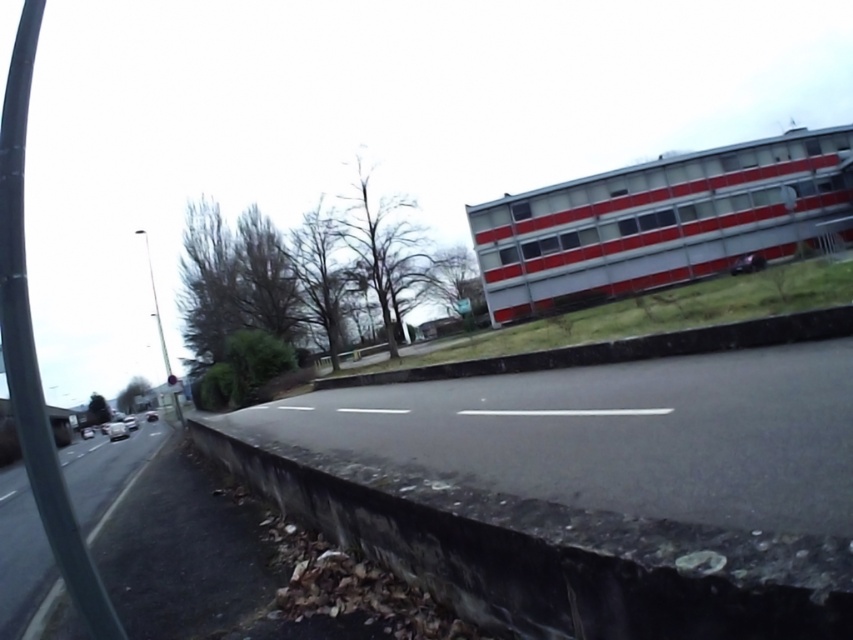
You are navigating a delivery drone that needs to land precisely on the concrete curb at lower center. According to the coordinates provided, is the landing zone within the visible area of the image?

The concrete curb at lower center is located at point (x=552, y=554), which falls within the visible area of the image, so the landing zone is accessible.